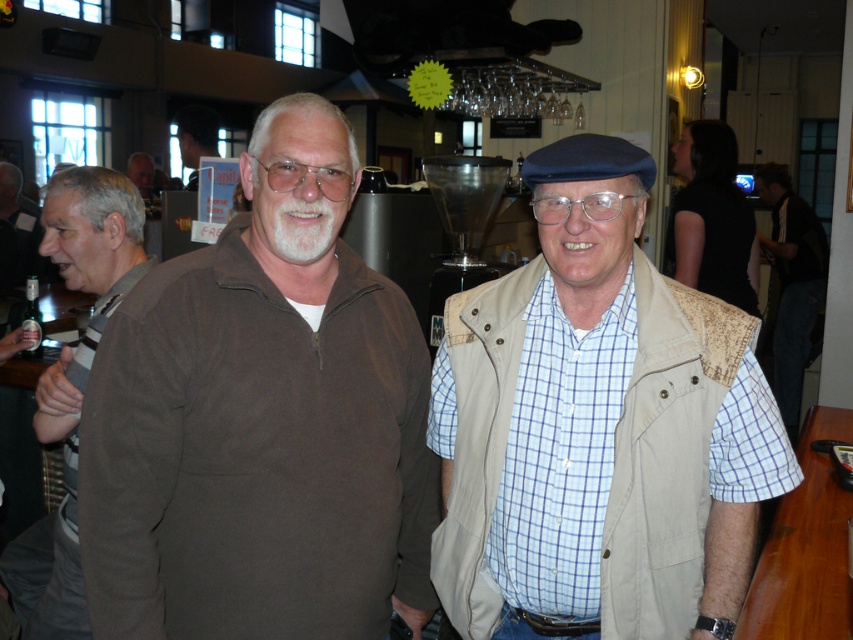
Does brown suede sweater at center lie in front of beige textured vest at center?

No.

This screenshot has width=853, height=640. Describe the element at coordinates (262, 420) in the screenshot. I see `brown suede sweater at center` at that location.

You are a GUI agent. You are given a task and a screenshot of the screen. Output one action in this format:
    pyautogui.click(x=<x>, y=<y>)
    Task: Click on the brown suede sweater at center
    
    Given the screenshot: What is the action you would take?
    pyautogui.click(x=262, y=420)

What are the coordinates of `brown suede sweater at center` in the screenshot? It's located at (262, 420).

Between blue checkered shirt at right and matte black jacket at upper left, which one has more height?

Standing taller between the two is blue checkered shirt at right.

Does blue checkered shirt at right have a lesser width compared to matte black jacket at upper left?

No.

Is point (776, 216) closer to viewer compared to point (192, 189)?

No.

What are the coordinates of `blue checkered shirt at right` in the screenshot? It's located at (792, 284).

Is brown suede sweater at center above blue checkered shirt at right?

No, brown suede sweater at center is not above blue checkered shirt at right.

Is brown suede sweater at center to the right of blue checkered shirt at right from the viewer's perspective?

Incorrect, brown suede sweater at center is not on the right side of blue checkered shirt at right.

Does point (399, 360) lie in front of point (821, 227)?

That is True.

Where is `brown suede sweater at center`? The width and height of the screenshot is (853, 640). brown suede sweater at center is located at coordinates (262, 420).